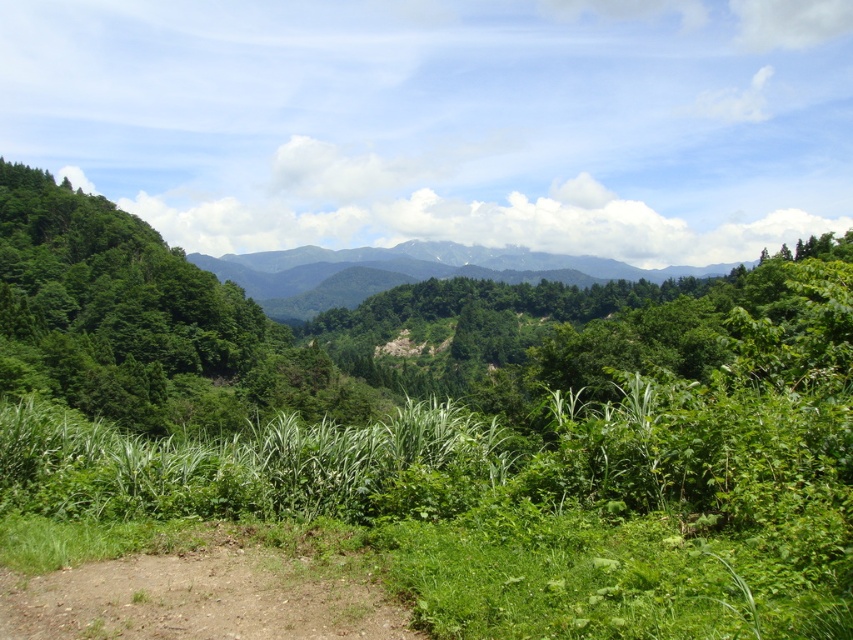
Who is more distant from viewer, (0, 342) or (448, 253)?

Point (448, 253)

Is green leafy tree at left positioned at the back of green forested mountain at center?

No, it is in front of green forested mountain at center.

At what (x,y) coordinates should I click in order to perform the action: click on green leafy tree at left. Please return your answer as a coordinate pair (x, y). Looking at the image, I should click on (142, 323).

Where is `green leafy tree at left`? The width and height of the screenshot is (853, 640). green leafy tree at left is located at coordinates (142, 323).

Who is positioned more to the left, brown dirt track at lower left or green forested mountain at center?

brown dirt track at lower left is more to the left.

Is point (28, 625) less distant than point (450, 241)?

Yes, point (28, 625) is in front of point (450, 241).

Identify the location of brown dirt track at lower left. (190, 580).

The image size is (853, 640). Find the location of `brown dirt track at lower left`. brown dirt track at lower left is located at coordinates (190, 580).

Is green leafy tree at left wider than brown dirt track at lower left?

Yes.

Between point (67, 294) and point (102, 540), which one is positioned in front?

Point (102, 540) is more forward.

What are the coordinates of `green leafy tree at left` in the screenshot? It's located at (142, 323).